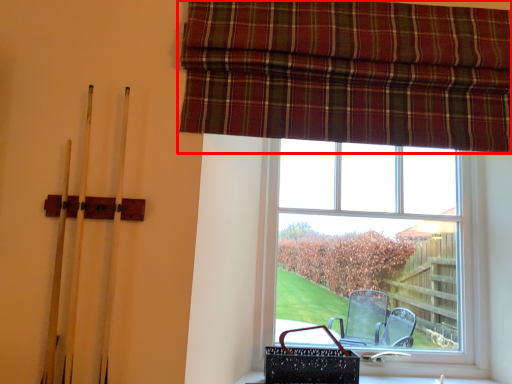
Question: From the image's perspective, considering the relative positions of curtain (annotated by the red box) and window in the image provided, where is curtain (annotated by the red box) located with respect to the staircase?

Choices:
 (A) above
 (B) below

Answer: (A)